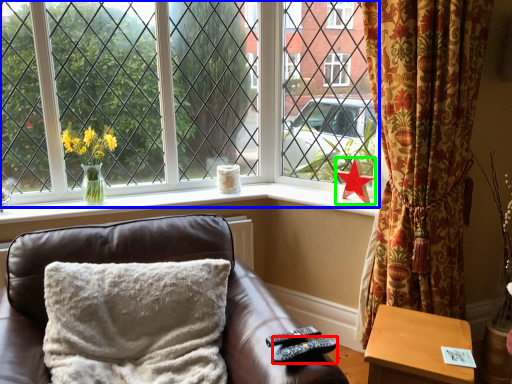
Question: Which object is the closest to the remote (highlighted by a red box)? Choose among these: window (highlighted by a blue box) or daffodil (highlighted by a green box).

Choices:
 (A) window
 (B) daffodil

Answer: (B)